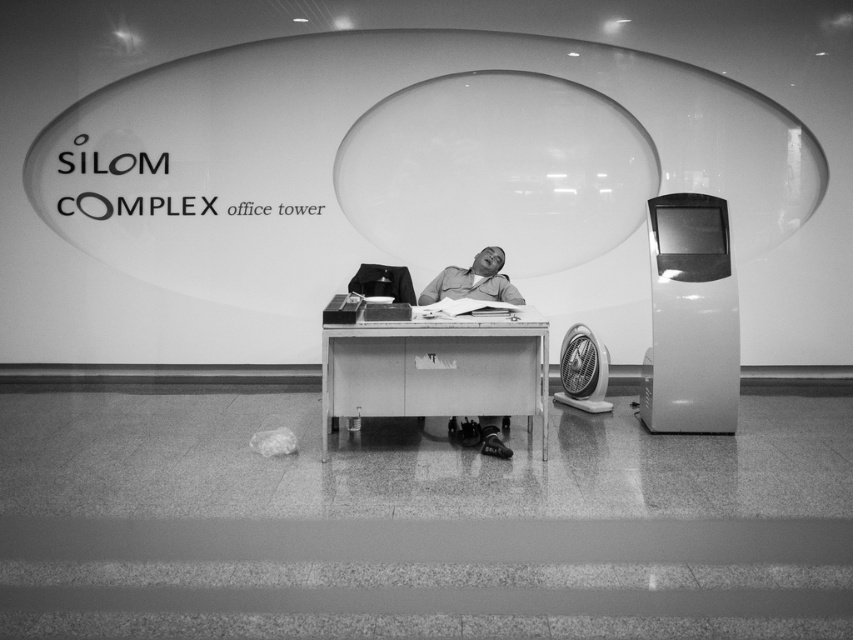
Question: Does metallic/smooth table at center appear under matte gray shirt at center?

Choices:
 (A) no
 (B) yes

Answer: (B)

Question: Among these objects, which one is farthest from the camera?

Choices:
 (A) transparent glass bubble at upper center
 (B) metallic/smooth table at center

Answer: (A)

Question: Which object is farther from the camera taking this photo?

Choices:
 (A) transparent glass bubble at upper center
 (B) matte gray shirt at center
 (C) metallic/smooth table at center

Answer: (A)

Question: Does transparent glass bubble at upper center have a larger size compared to matte gray shirt at center?

Choices:
 (A) no
 (B) yes

Answer: (B)

Question: Which point appears closest to the camera in this image?

Choices:
 (A) (335, 352)
 (B) (529, 72)

Answer: (A)

Question: Is transparent glass bubble at upper center closer to camera compared to metallic/smooth table at center?

Choices:
 (A) yes
 (B) no

Answer: (B)